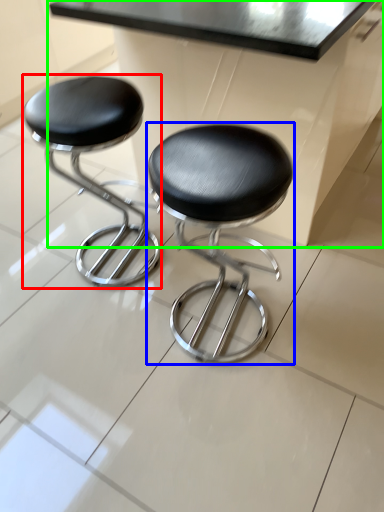
Question: Estimate the real-world distances between objects in this image. Which object is farther from stool (highlighted by a red box), stool (highlighted by a blue box) or table (highlighted by a green box)?

Choices:
 (A) stool
 (B) table

Answer: (A)